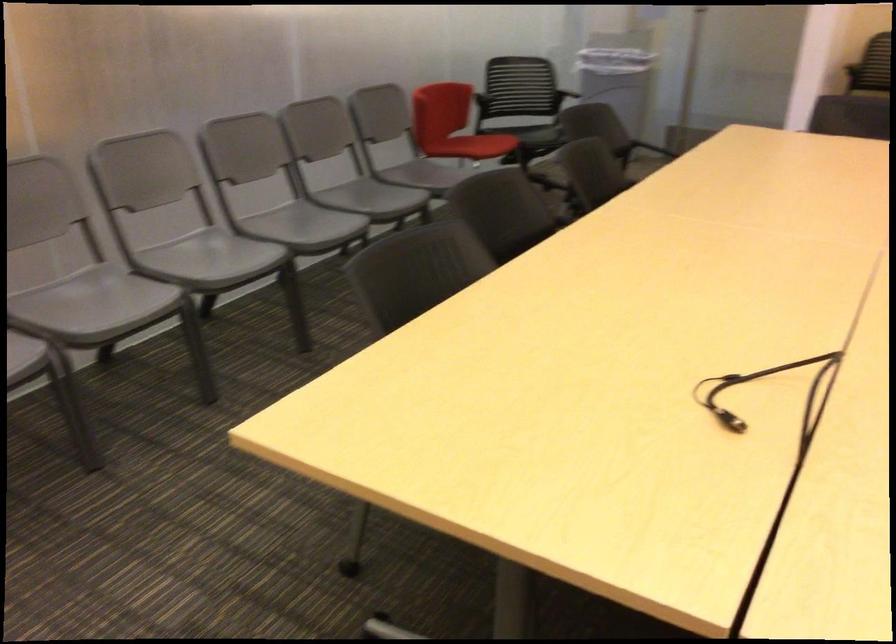
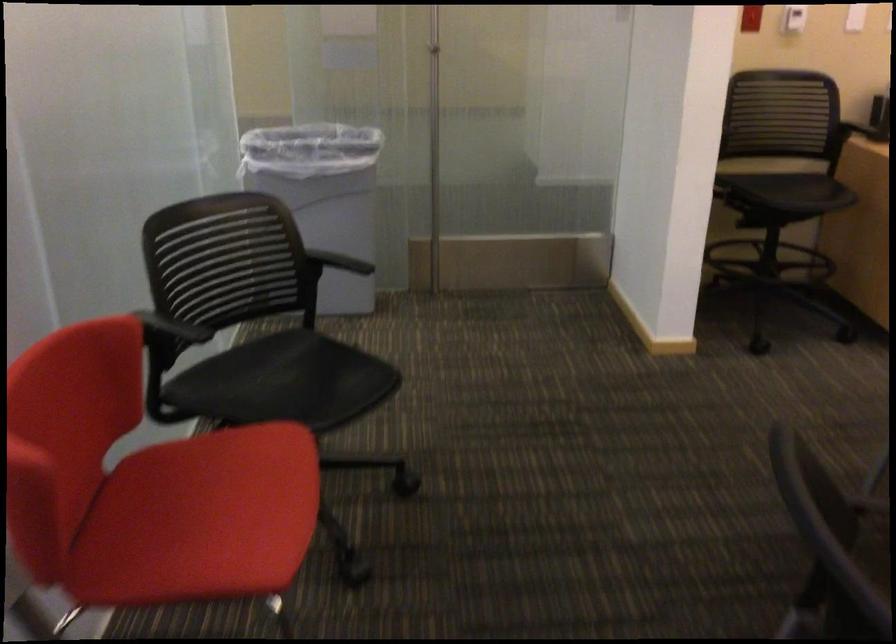
Where in the second image is the point corresponding to the point at 624,79 from the first image?

(323, 196)